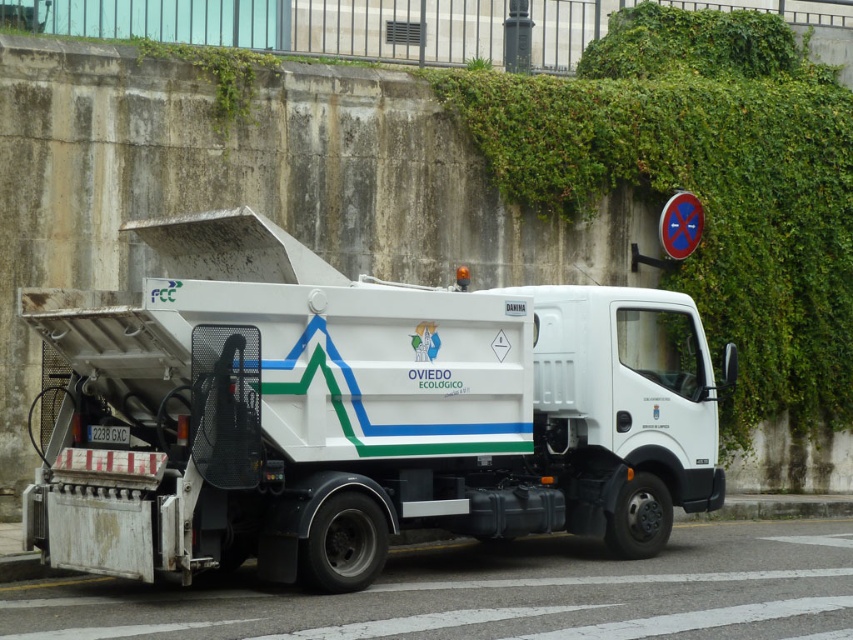
You are a pedestrian standing on the sidewalk and see the white matte truck at center and the green leafy ivy at upper right in the image. Which object is positioned higher from the ground?

The green leafy ivy at upper right is positioned higher from the ground than the white matte truck at center.

From the picture: You are a delivery person who needs to attach a package to the refuse collection truck. The truck has a point marked at coordinates (706, 196) where green leafy ivy is growing. Where on the truck would you place the package to avoid damaging the ivy?

Place the package away from the point marked at (706, 196) where green leafy ivy is growing to avoid damaging it.

You are a delivery person standing next to the white matte truck at center. You need to place a package in the metallic blue circle at upper right. Can you reach it without moving the truck?

The white matte truck at center is 24.35 feet away from the metallic blue circle at upper right. Since the distance is too far to reach manually, you would need to move closer or use a tool to place the package in the metallic blue circle at upper right.